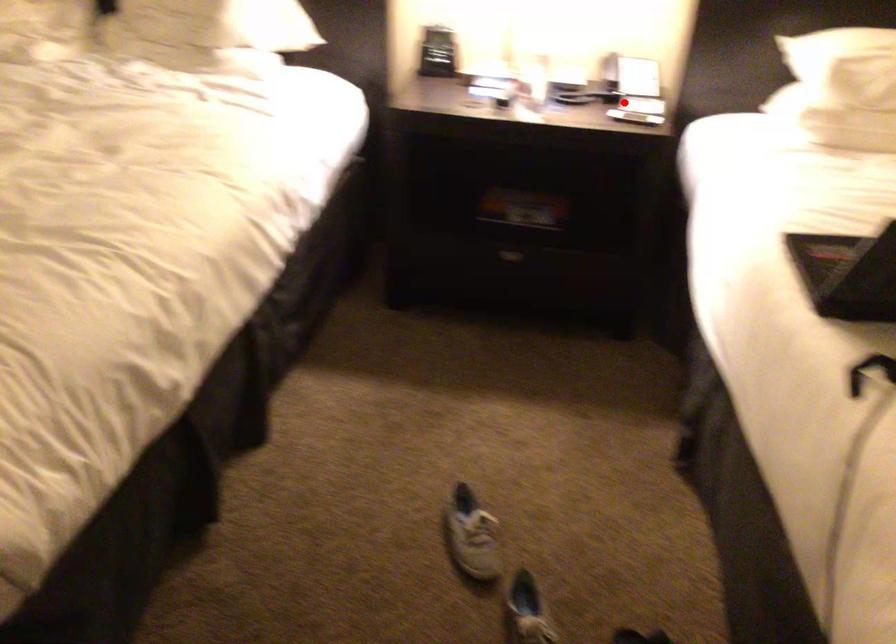
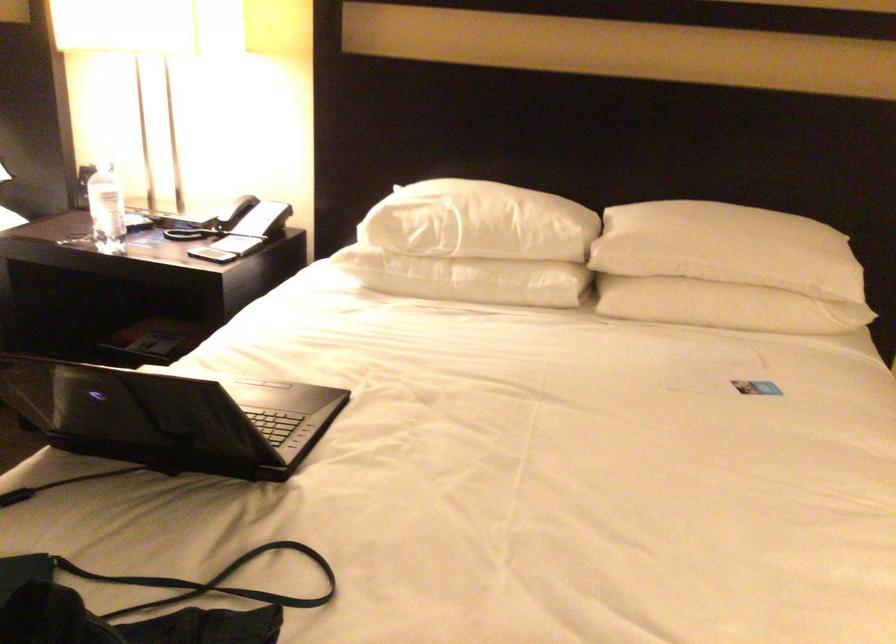
Find the pixel in the second image that matches the highlighted location in the first image.

(211, 249)